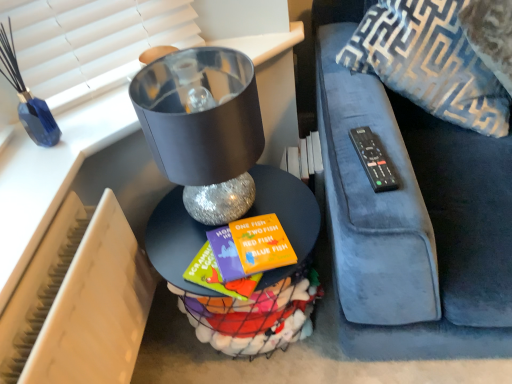
Question: Looking at their shapes, would you say metallic silver table at center is wider or thinner than black plastic remote at right?

Choices:
 (A) wide
 (B) thin

Answer: (A)

Question: Is point (164, 274) positioned closer to the camera than point (373, 170)?

Choices:
 (A) farther
 (B) closer

Answer: (A)

Question: Estimate the real-world distances between objects in this image. Which object is closer to the beige plastic radiator at lower left?

Choices:
 (A) shiny metallic lampshade at center
 (B) black plastic remote at right
 (C) metallic silver table at center
 (D) blue textured throw pillow at upper right

Answer: (C)

Question: Which object is positioned farthest from the shiny metallic lampshade at center?

Choices:
 (A) black plastic remote at right
 (B) blue textured throw pillow at upper right
 (C) beige plastic radiator at lower left
 (D) metallic silver table at center

Answer: (B)